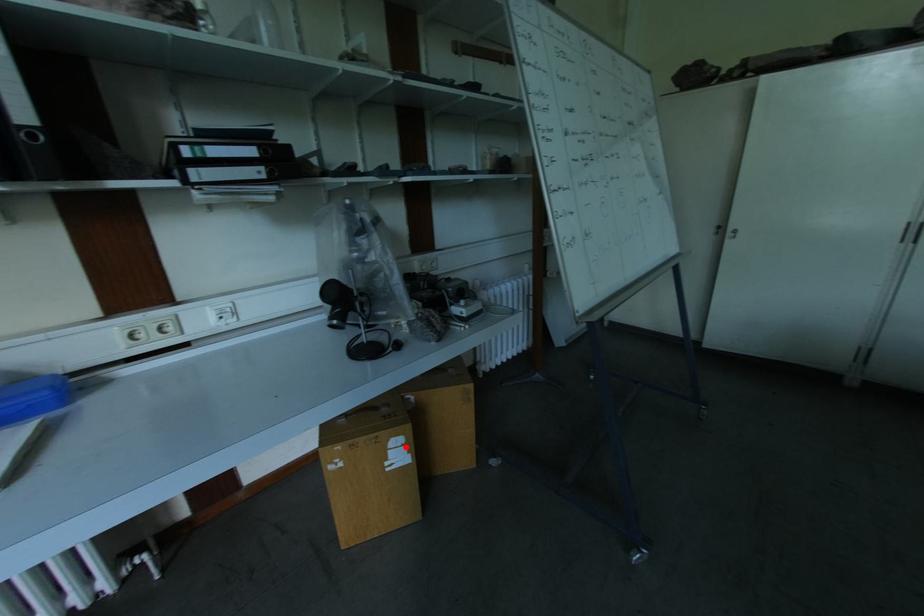
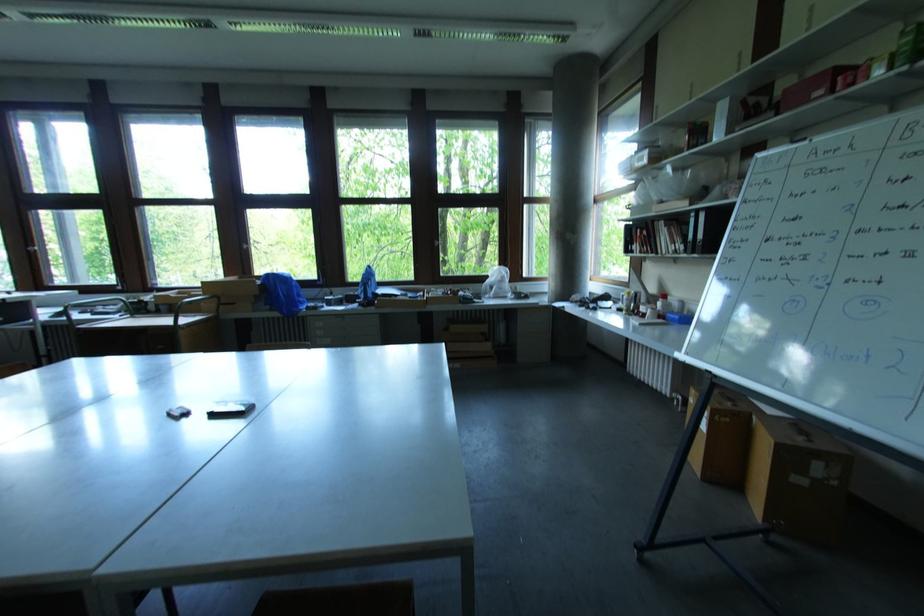
In the second image, find the point that corresponds to the highlighted location in the first image.

(709, 419)